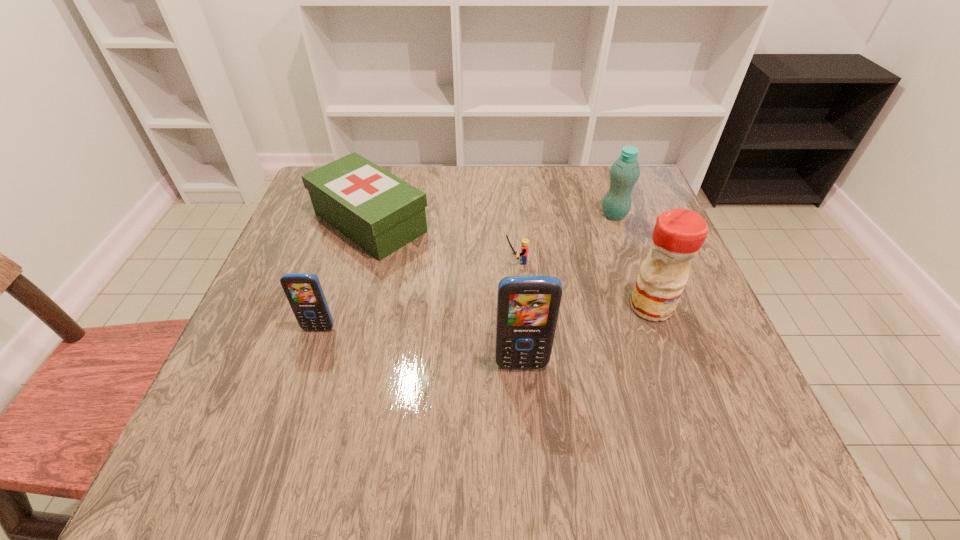
The cellular telephones are evenly distributed in the image. To maintain this, where would you place another cellular telephone on the right? Please point to a free space. Please provide its 2D coordinates. Your answer should be formatted as a tuple, i.e. [(x, y)], where the tuple contains the x and y coordinates of a point satisfying the conditions above.

[(756, 407)]